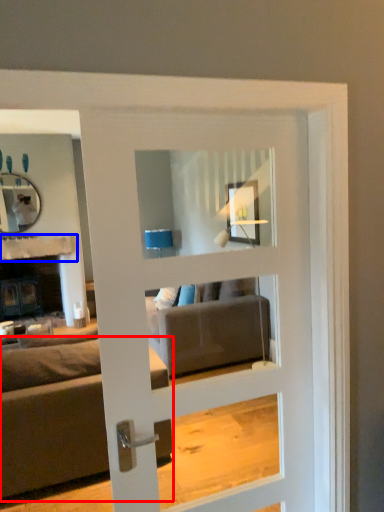
Question: Which of the following is the farthest to the observer, studio couch (highlighted by a red box) or balustrade (highlighted by a blue box)?

Choices:
 (A) studio couch
 (B) balustrade

Answer: (B)